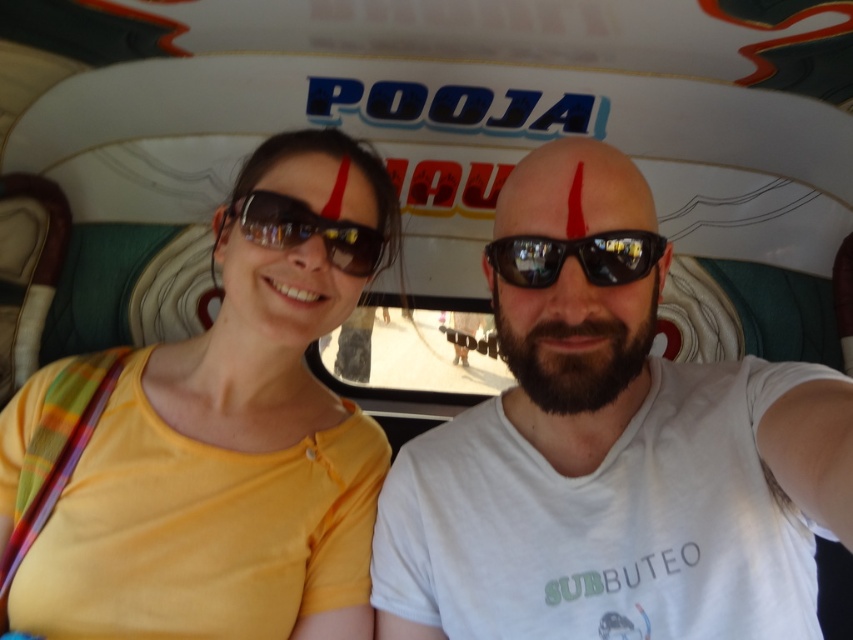
Is black matte sunglasses at center smaller than matte yellow shirt at center?

No.

Measure the distance between point [527,168] and camera.

99.85 centimeters

Identify the location of black matte sunglasses at center. This screenshot has height=640, width=853. (573, 278).

Find the location of `black matte sunglasses at center`. black matte sunglasses at center is located at coordinates (573, 278).

Is the position of yellow matte shirt at upper left more distant than that of matte yellow shirt at center?

No, it is not.

Does yellow matte shirt at upper left appear on the left side of matte yellow shirt at center?

Yes, yellow matte shirt at upper left is to the left of matte yellow shirt at center.

Identify the location of yellow matte shirt at upper left. Image resolution: width=853 pixels, height=640 pixels. (235, 433).

Where is `yellow matte shirt at upper left`? The image size is (853, 640). yellow matte shirt at upper left is located at coordinates (235, 433).

From the picture: Is red matte forehead at center wider than matte black goggles at center?

In fact, red matte forehead at center might be narrower than matte black goggles at center.

Who is taller, red matte forehead at center or matte black goggles at center?

Standing taller between the two is red matte forehead at center.

You are a GUI agent. You are given a task and a screenshot of the screen. Output one action in this format:
    pyautogui.click(x=<x>, y=<y>)
    Task: Click on the red matte forehead at center
    
    Given the screenshot: What is the action you would take?
    pyautogui.click(x=573, y=193)

Locate an element on the screen. This screenshot has height=640, width=853. red matte forehead at center is located at coordinates (573, 193).